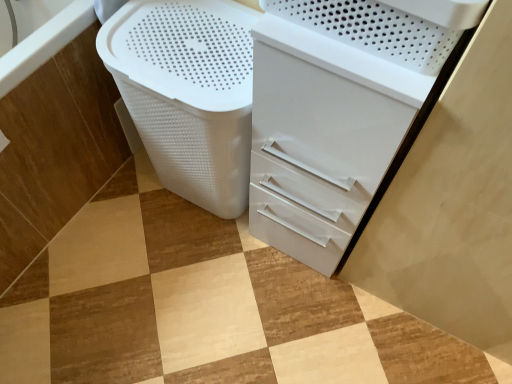
I want to click on free space above white plastic laundry basket at lower left (from a real-world perspective), so click(164, 47).